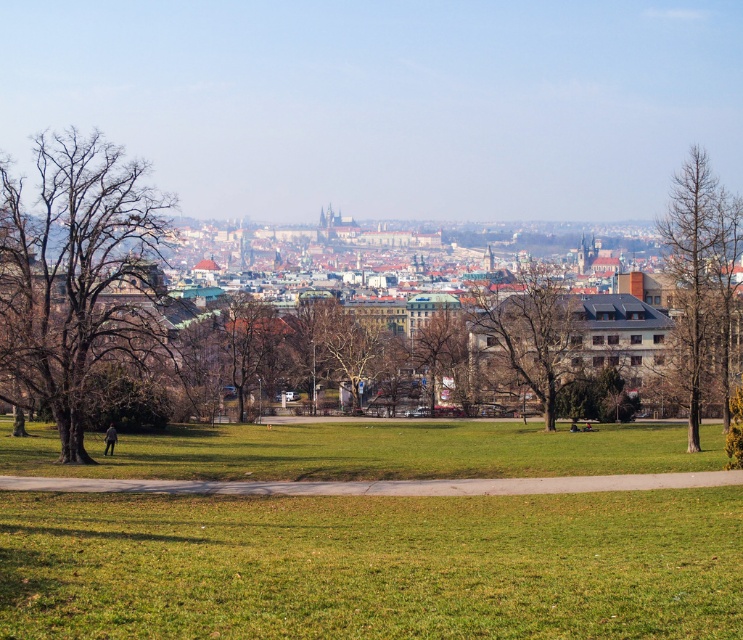
Between green grass at center and brown leafless tree at center, which one has more height?

Standing taller between the two is brown leafless tree at center.

Consider the image. Who is positioned more to the left, green grass at center or brown leafless tree at center?

Positioned to the left is green grass at center.

Does point (535, 500) come closer to viewer compared to point (454, 326)?

Yes, it is.

The image size is (743, 640). I want to click on green grass at center, so click(372, 564).

Does bare wood tree at left appear on the left side of brown textured tree at center?

Indeed, bare wood tree at left is positioned on the left side of brown textured tree at center.

Is bare wood tree at left below brown textured tree at center?

Actually, bare wood tree at left is above brown textured tree at center.

Is point (137, 346) in front of point (516, 376)?

Yes.

I want to click on bare wood tree at left, so click(x=77, y=276).

Looking at this image, can you confirm if green grass at center is positioned to the right of brown/dry wood tree at right?

No, green grass at center is not to the right of brown/dry wood tree at right.

Which is behind, point (655, 433) or point (704, 346)?

The point (655, 433) is behind.

Locate an element on the screen. The width and height of the screenshot is (743, 640). green grass at center is located at coordinates coord(372,564).